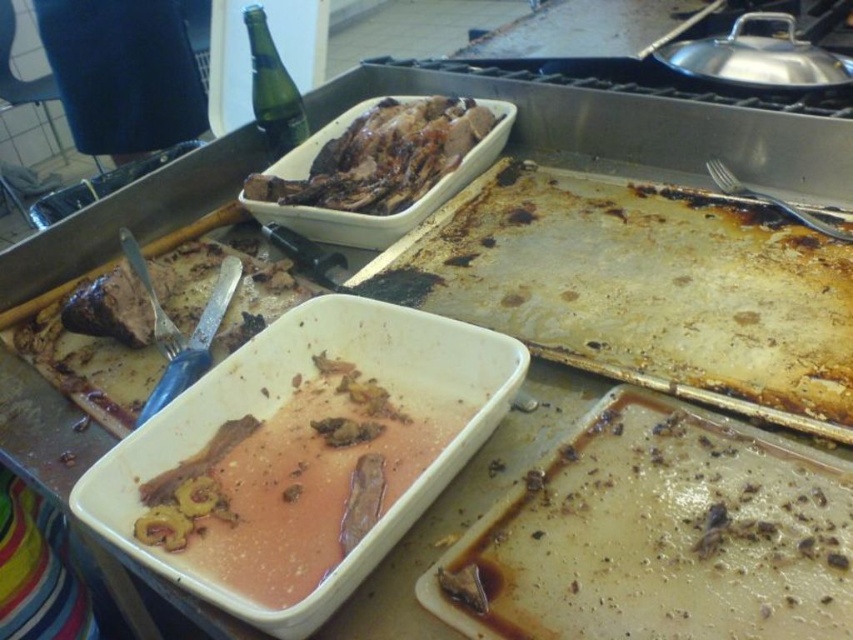
You are a person standing at the kitchen counter. You need to reach both the point at (292, 474) and the point at (279, 88). Which point should you reach for first to minimize the distance traveled?

You should reach for point (292, 474) first because it is in front of point (279, 88), so you can grab it without moving further back.

You are a chef preparing to clean the kitchen. You need to pour the pink glossy sauce at center into the green glass bottle at upper left. Will the bottle be tall enough to hold the sauce?

The pink glossy sauce at center is shorter than green glass bottle at upper left, so the green glass bottle at upper left is tall enough to hold the sauce.